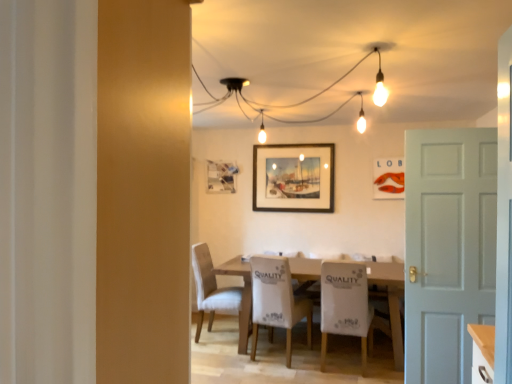
Question: Looking at their shapes, would you say white fabric chair at center, placed as the third chair when sorted from left to right, is wider or thinner than wooden table at center?

Choices:
 (A) thin
 (B) wide

Answer: (A)

Question: From a real-world perspective, is white fabric chair at center, which is the first chair from right to left, positioned above or below wooden table at center?

Choices:
 (A) above
 (B) below

Answer: (A)

Question: Considering the real-world distances, which object is farthest from the white fabric chair at center, which is the first chair from right to left?

Choices:
 (A) white matte door at right
 (B) matte orange lobster at upper center, placed as the 3th picture frame when sorted from left to right
 (C) wooden table at center
 (D) white fabric chair at center, placed as the second chair when sorted from left to right
 (E) matte glass picture frame at center, acting as the 3th picture frame starting from the front

Answer: (E)

Question: Estimate the real-world distances between objects in this image. Which object is farther from the matte glass picture frame at center, which is counted as the 1th picture frame, starting from the back?

Choices:
 (A) light beige fabric chair at center, placed as the third chair when sorted from right to left
 (B) white fabric chair at center, which is the 2th chair from right to left
 (C) wooden framed painting at center, positioned as the second picture frame in left-to-right order
 (D) matte orange lobster at upper center, which is the 3th picture frame from back to front
 (E) white matte door at right

Answer: (E)